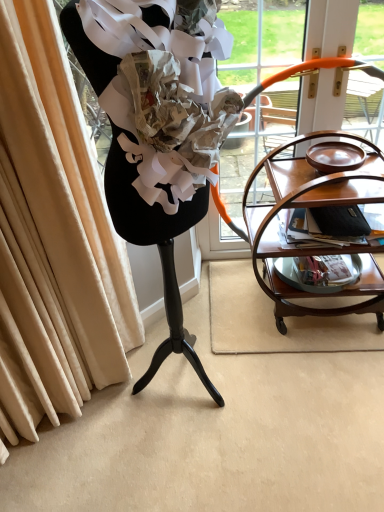
Question: Can you confirm if matte brown magazine at right is smaller than wooden tea cart at right?

Choices:
 (A) yes
 (B) no

Answer: (A)

Question: Can you confirm if matte brown magazine at right is bigger than wooden tea cart at right?

Choices:
 (A) yes
 (B) no

Answer: (B)

Question: Does matte brown magazine at right turn towards wooden tea cart at right?

Choices:
 (A) yes
 (B) no

Answer: (B)

Question: From the image's perspective, is matte brown magazine at right located above wooden tea cart at right?

Choices:
 (A) no
 (B) yes

Answer: (B)

Question: Does matte brown magazine at right have a greater width compared to wooden tea cart at right?

Choices:
 (A) no
 (B) yes

Answer: (A)

Question: From the image's perspective, relative to matte brown magazine at right, is wooden tea cart at right above or below?

Choices:
 (A) below
 (B) above

Answer: (A)

Question: Is wooden tea cart at right spatially inside matte brown magazine at right, or outside of it?

Choices:
 (A) outside
 (B) inside

Answer: (A)

Question: Considering the positions of wooden tea cart at right and matte brown magazine at right in the image, is wooden tea cart at right taller or shorter than matte brown magazine at right?

Choices:
 (A) tall
 (B) short

Answer: (A)

Question: Is wooden tea cart at right wider or thinner than matte brown magazine at right?

Choices:
 (A) wide
 (B) thin

Answer: (A)

Question: Considering the positions of wooden tea cart at right and mahogany wood serving cart at right in the image, is wooden tea cart at right bigger or smaller than mahogany wood serving cart at right?

Choices:
 (A) small
 (B) big

Answer: (A)

Question: In the image, is wooden tea cart at right positioned in front of or behind mahogany wood serving cart at right?

Choices:
 (A) behind
 (B) front

Answer: (B)

Question: Based on their positions, is wooden tea cart at right located to the left or right of mahogany wood serving cart at right?

Choices:
 (A) right
 (B) left

Answer: (B)

Question: Is wooden tea cart at right inside or outside of mahogany wood serving cart at right?

Choices:
 (A) outside
 (B) inside

Answer: (A)

Question: Is point (365, 280) positioned closer to the camera than point (329, 215)?

Choices:
 (A) farther
 (B) closer

Answer: (A)

Question: Considering their positions, is mahogany wood serving cart at right located in front of or behind matte brown magazine at right?

Choices:
 (A) behind
 (B) front

Answer: (B)